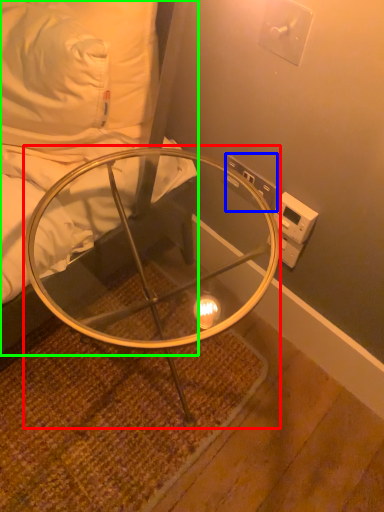
Question: Which object is positioned farthest from table (highlighted by a red box)? Select from electric outlet (highlighted by a blue box) and furniture (highlighted by a green box).

Choices:
 (A) electric outlet
 (B) furniture

Answer: (A)